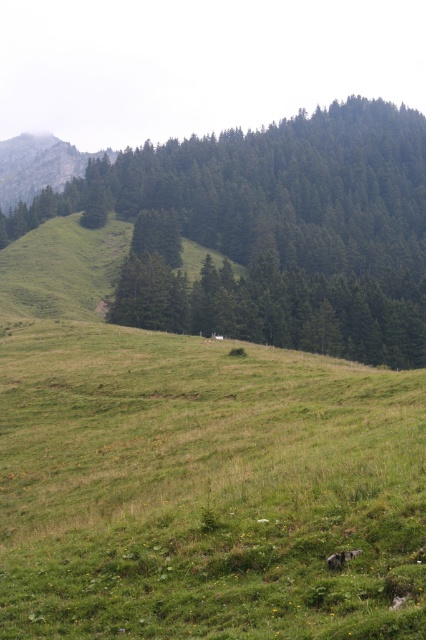
Question: Observing the image, what is the correct spatial positioning of green leafy tree at center in reference to rugged stone mountain at upper left?

Choices:
 (A) above
 (B) below

Answer: (B)

Question: Which of the following is the closest to the observer?

Choices:
 (A) rugged stone mountain at upper left
 (B) green leafy tree at center

Answer: (B)

Question: Which point is farther to the camera?

Choices:
 (A) rugged stone mountain at upper left
 (B) green leafy tree at center

Answer: (A)

Question: Is the position of green leafy tree at center more distant than that of rugged stone mountain at upper left?

Choices:
 (A) no
 (B) yes

Answer: (A)

Question: Is green leafy tree at center wider than rugged stone mountain at upper left?

Choices:
 (A) no
 (B) yes

Answer: (B)